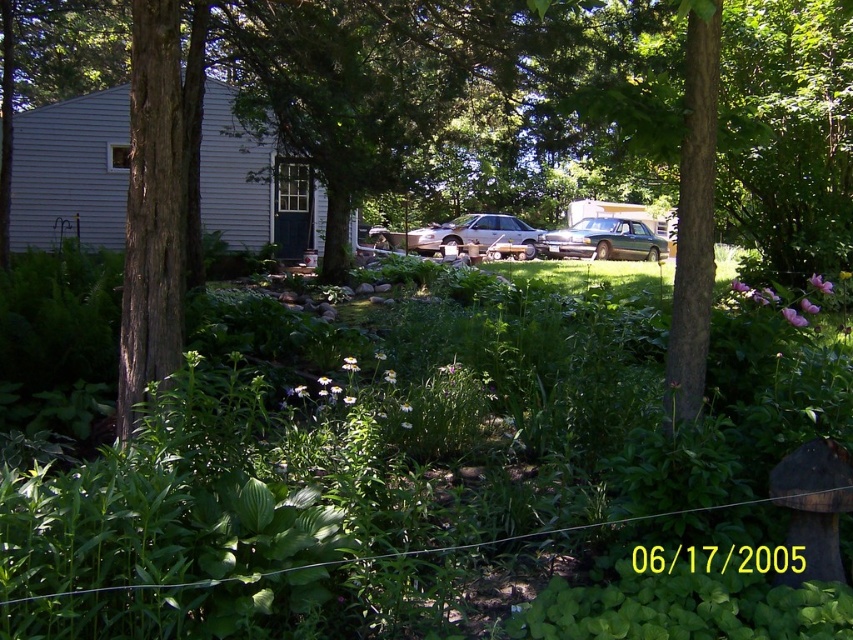
Is green matte sedan at center to the right of gold metallic car at center from the viewer's perspective?

Yes, green matte sedan at center is to the right of gold metallic car at center.

Is point (618, 234) farther from camera compared to point (483, 230)?

That is True.

Is point (612, 228) positioned in front of point (482, 246)?

That is False.

At what (x,y) coordinates should I click in order to perform the action: click on green matte sedan at center. Please return your answer as a coordinate pair (x, y). Image resolution: width=853 pixels, height=640 pixels. Looking at the image, I should click on (602, 241).

Does brown rough tree at center appear over green matte sedan at center?

Indeed, brown rough tree at center is positioned over green matte sedan at center.

Between point (651, 147) and point (637, 250), which one is positioned in front?

Positioned in front is point (651, 147).

In order to click on brown rough tree at center in this screenshot , I will do `click(466, 93)`.

How far apart are brown rough tree at center and gold metallic car at center?

brown rough tree at center is 56.42 feet from gold metallic car at center.

Between point (508, 122) and point (502, 221), which one is positioned behind?

Point (502, 221)

Is point (370, 45) positioned before point (521, 234)?

Yes, point (370, 45) is in front of point (521, 234).

Where is `brown rough tree at center`? brown rough tree at center is located at coordinates (466, 93).